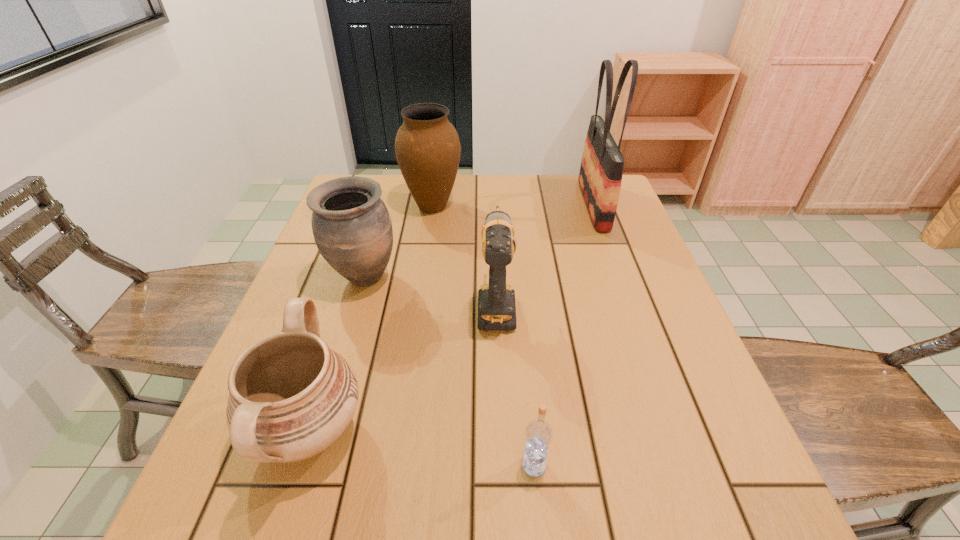
The width and height of the screenshot is (960, 540). I want to click on object that is at the near edge, so click(291, 397).

At what (x,y) coordinates should I click in order to perform the action: click on object at the right edge. Please return your answer as a coordinate pair (x, y). Looking at the image, I should click on (601, 170).

Identify the location of object positioned at the near left corner. This screenshot has width=960, height=540. (291, 397).

Identify the location of object that is positioned at the far right corner. The height and width of the screenshot is (540, 960). (601, 170).

In order to click on free spot at the far edge of the desktop in this screenshot , I will do `click(476, 197)`.

Where is `vacant space at the near edge of the desktop`? vacant space at the near edge of the desktop is located at coordinates (406, 529).

This screenshot has height=540, width=960. I want to click on vacant region at the left edge of the desktop, so click(x=348, y=336).

In the image, there is a desktop. Identify the location of vacant space at the right edge. (668, 295).

This screenshot has height=540, width=960. In the image, there is a desktop. Find the location of `vacant space at the near left corner`. vacant space at the near left corner is located at coordinates (207, 532).

In order to click on free space between the rightmost object and the vodka in this screenshot , I will do `click(564, 335)`.